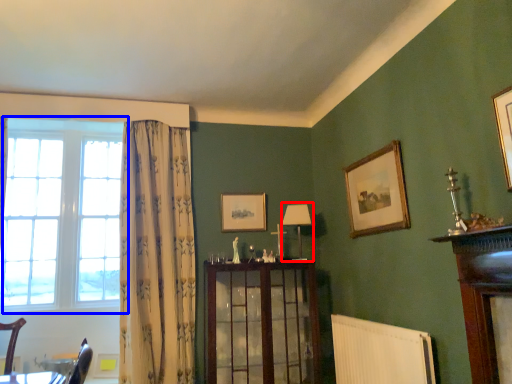
Question: Among these objects, which one is nearest to the camera, lamp (highlighted by a red box) or window (highlighted by a blue box)?

Choices:
 (A) lamp
 (B) window

Answer: (B)